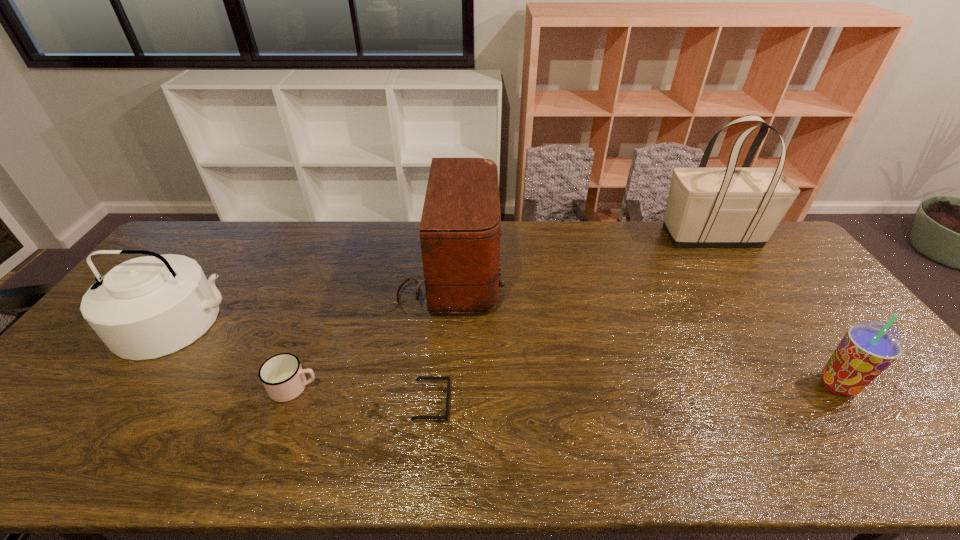
I want to click on free spot located 0.200m on the front panel of the radio receiver, so (x=564, y=274).

I want to click on free location located on the spout of the kettle, so click(126, 397).

This screenshot has height=540, width=960. Find the location of `free space located on the back of the smoothie`. free space located on the back of the smoothie is located at coordinates (786, 315).

You are a GUI agent. You are given a task and a screenshot of the screen. Output one action in this format:
    pyautogui.click(x=<x>, y=<y>)
    Task: Click on the free space located 0.380m on the side of the fifth tallest object with the handle
    Image resolution: width=960 pixels, height=540 pixels.
    Given the screenshot: What is the action you would take?
    pyautogui.click(x=471, y=387)

Locate an element on the screen. vacant area situated 0.130m on the front-facing side of the sunglasses is located at coordinates (503, 403).

Where is `shopping bag that is positioned at the far edge`? shopping bag that is positioned at the far edge is located at coordinates (730, 206).

At what (x,y) coordinates should I click in order to perform the action: click on radio receiver present at the far edge. Please return your answer as a coordinate pair (x, y). Looking at the image, I should click on (460, 229).

Find the location of a particular element. The image size is (960, 540). object present at the left edge is located at coordinates (147, 307).

The image size is (960, 540). I want to click on shopping bag that is positioned at the right edge, so click(x=730, y=206).

The height and width of the screenshot is (540, 960). I want to click on smoothie located at the right edge, so 868,348.